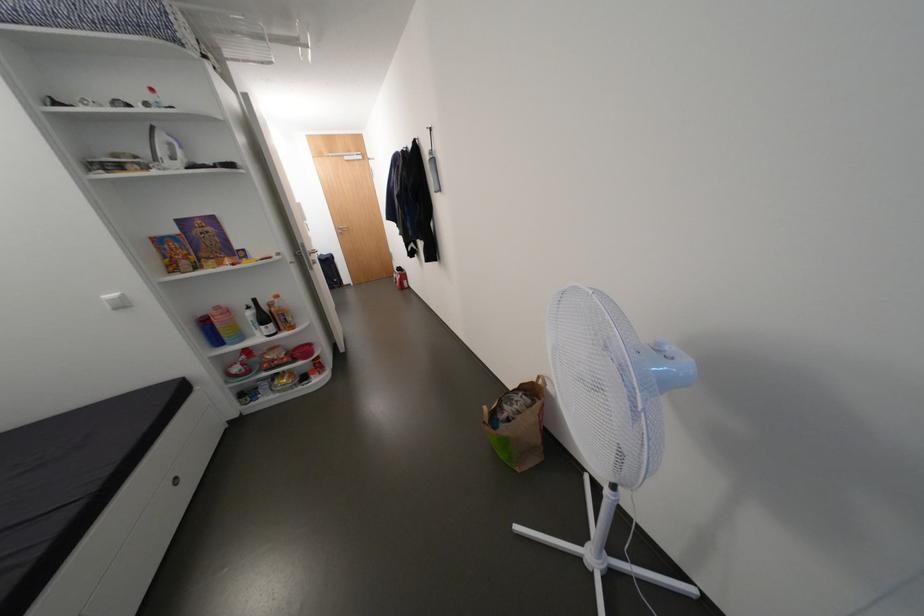
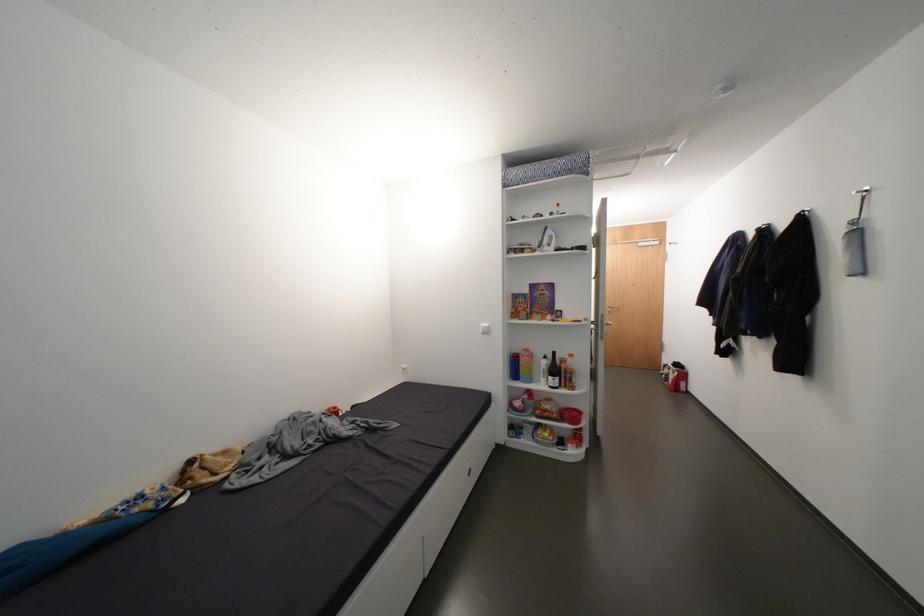
Find the pixel in the second image that matches (281,310) in the first image.

(570, 367)